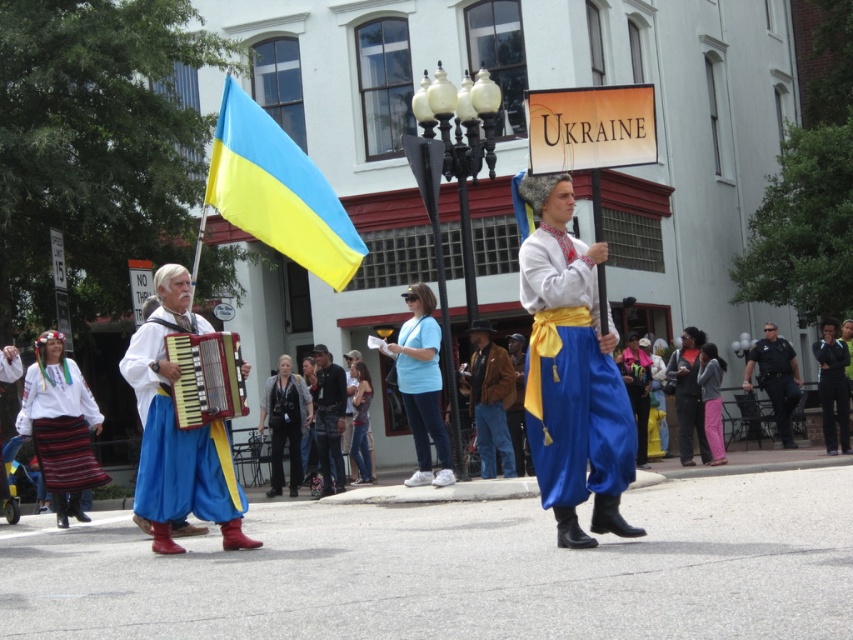
Question: Is dark blue uniform at center positioned in front of blue satin pants at center?

Choices:
 (A) yes
 (B) no

Answer: (B)

Question: Estimate the real-world distances between objects in this image. Which object is farther from the blue satin pants at center?

Choices:
 (A) matte blue fabric skirt at left
 (B) embroidered cotton skirt at lower left
 (C) wooden accordion at center

Answer: (A)

Question: Which point is closer to the camera?

Choices:
 (A) matte blue fabric pants at center
 (B) blue satin robe at center
 (C) blue/yellow fabric flag at center
 (D) matte blue fabric skirt at left

Answer: (A)

Question: Can you confirm if matte blue fabric pants at center is bigger than embroidered cotton skirt at lower left?

Choices:
 (A) yes
 (B) no

Answer: (B)

Question: Does wooden accordion at center have a lesser width compared to black fabric pants at right?

Choices:
 (A) yes
 (B) no

Answer: (B)

Question: Among these points, which one is farthest from the camera?

Choices:
 (A) (73, 381)
 (B) (636, 456)
 (C) (175, 342)

Answer: (B)